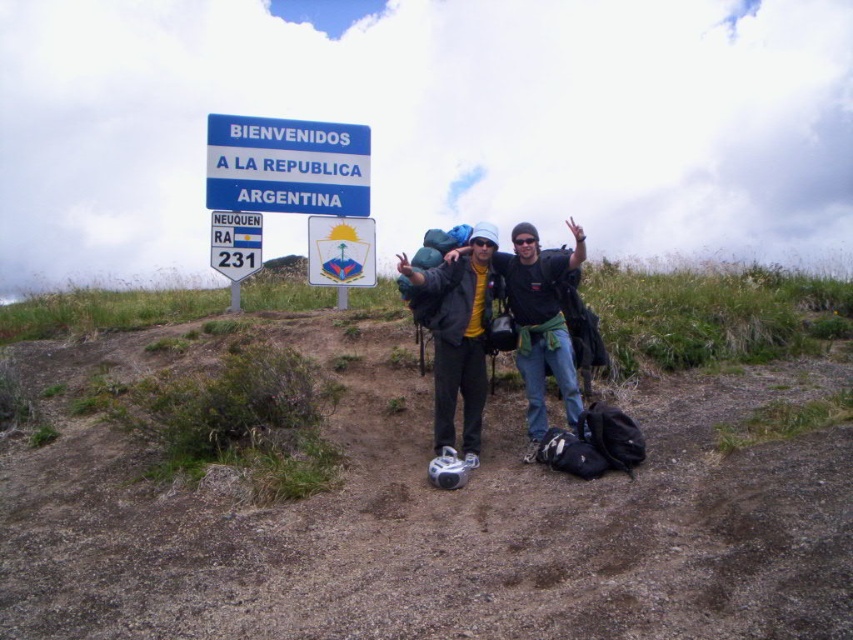
Which is in front, point (521, 307) or point (299, 154)?

Point (521, 307) is in front.

Does matte black jacket at center have a greater height compared to blue plastic sign at upper center?

Yes, matte black jacket at center is taller than blue plastic sign at upper center.

Image resolution: width=853 pixels, height=640 pixels. I want to click on matte black jacket at center, so click(x=490, y=326).

Locate an element on the screen. This screenshot has width=853, height=640. matte black jacket at center is located at coordinates (490, 326).

Is matte plastic sign at upper center closer to camera compared to white plastic sign at upper center?

No, matte plastic sign at upper center is behind white plastic sign at upper center.

In the scene shown: Does matte plastic sign at upper center appear under white plastic sign at upper center?

Correct, matte plastic sign at upper center is located below white plastic sign at upper center.

Does point (337, 227) come behind point (219, 221)?

Yes.

At what (x,y) coordinates should I click in order to perform the action: click on matte plastic sign at upper center. Please return your answer as a coordinate pair (x, y). Looking at the image, I should click on (340, 252).

Does point (471, 332) come farther from viewer compared to point (351, 252)?

No, it is not.

Who is positioned more to the left, matte black jacket at center or matte plastic sign at upper center?

Positioned to the left is matte plastic sign at upper center.

What do you see at coordinates (490, 326) in the screenshot? I see `matte black jacket at center` at bounding box center [490, 326].

Find the location of a particular element. Image resolution: width=853 pixels, height=640 pixels. matte black jacket at center is located at coordinates (490, 326).